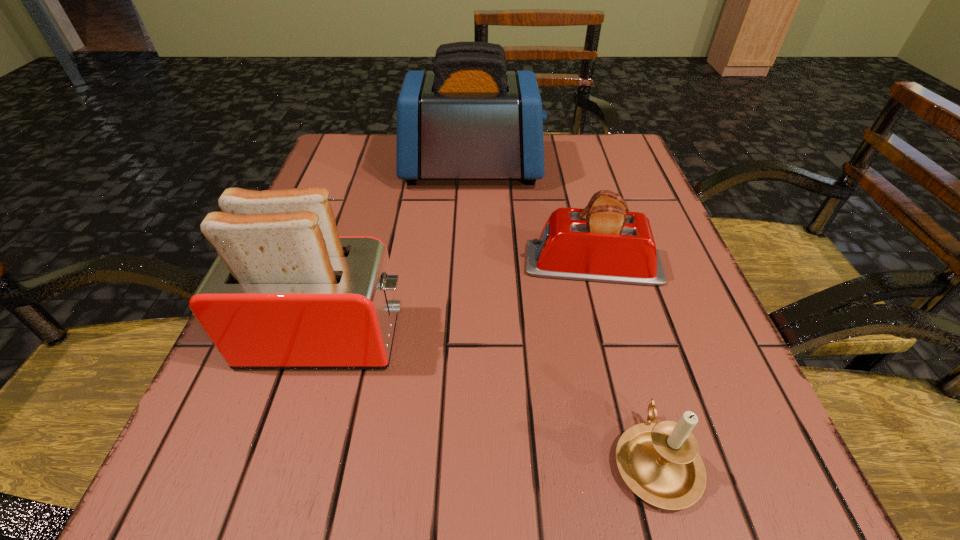
I want to click on free location that satisfies the following two spatial constraints: 1. with a handle on the side of the nearest object; 2. on the front-facing side of the third farthest object, so click(x=621, y=338).

Where is `vacant space that satisfies the following two spatial constraints: 1. on the front-facing side of the shortest toaster; 2. on the right side of the farthest object`? This screenshot has height=540, width=960. vacant space that satisfies the following two spatial constraints: 1. on the front-facing side of the shortest toaster; 2. on the right side of the farthest object is located at coordinates (469, 264).

The width and height of the screenshot is (960, 540). What are the coordinates of `blank area in the image that satisfies the following two spatial constraints: 1. on the front-facing side of the third farthest object; 2. with a handle on the side of the candle holder` in the screenshot? It's located at (290, 460).

The image size is (960, 540). What are the coordinates of `free location that satisfies the following two spatial constraints: 1. with a handle on the side of the candle holder; 2. on the front-facing side of the farthest object` in the screenshot? It's located at (573, 169).

In order to click on free space that satisfies the following two spatial constraints: 1. on the front-facing side of the farthest object; 2. with a handle on the side of the candle holder in this screenshot , I will do `click(465, 460)`.